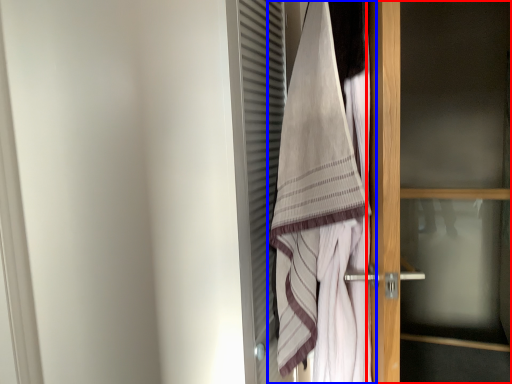
Question: Which of the following is the farthest to the observer, door (highlighted by a red box) or towel (highlighted by a blue box)?

Choices:
 (A) door
 (B) towel

Answer: (A)